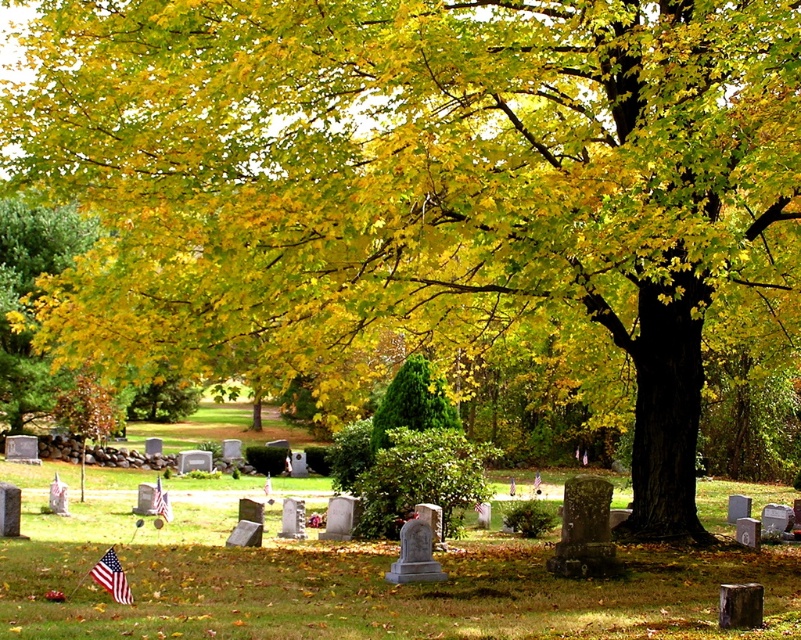
Based on the photo, you are a visitor at the cemetery and want to find the newer grave marker. You notice two American flags placed at the american flag at lower left and the american flag at center. According to cemetery traditions, the flag closer to the grave marker is placed in front. Which flag is placed closer to its respective grave marker?

The american flag at lower left is in front of the american flag at center, so the american flag at lower left is placed closer to its respective grave marker.